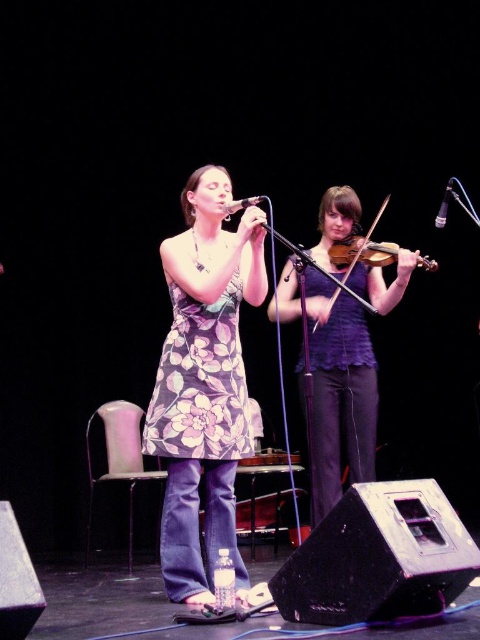
Between floral-patterned dress at center and floral-patterned fabric dress at center, which one appears on the right side from the viewer's perspective?

floral-patterned dress at center is more to the right.

Looking at this image, can you confirm if floral-patterned dress at center is positioned below floral-patterned fabric dress at center?

Indeed, floral-patterned dress at center is positioned under floral-patterned fabric dress at center.

Is point (248, 289) farther from camera compared to point (156, 435)?

Yes, it is behind point (156, 435).

Where is `floral-patterned dress at center`? floral-patterned dress at center is located at coordinates (204, 384).

Does floral-patterned dress at center have a smaller size compared to purple textured top at center?

Yes, floral-patterned dress at center is smaller than purple textured top at center.

Who is positioned more to the left, floral-patterned dress at center or purple textured top at center?

floral-patterned dress at center

Is point (215, 170) less distant than point (346, 404)?

Yes.

At what (x,y) coordinates should I click in order to perform the action: click on floral-patterned dress at center. Please return your answer as a coordinate pair (x, y). This screenshot has width=480, height=640. Looking at the image, I should click on (204, 384).

Is purple textured top at center taller than wooden violin at center?

Correct, purple textured top at center is much taller as wooden violin at center.

Can you confirm if purple textured top at center is wider than wooden violin at center?

Correct, the width of purple textured top at center exceeds that of wooden violin at center.

Is point (354, 333) farther from viewer compared to point (380, 248)?

Yes.

Find the location of `purple textured top at center`. purple textured top at center is located at coordinates (338, 392).